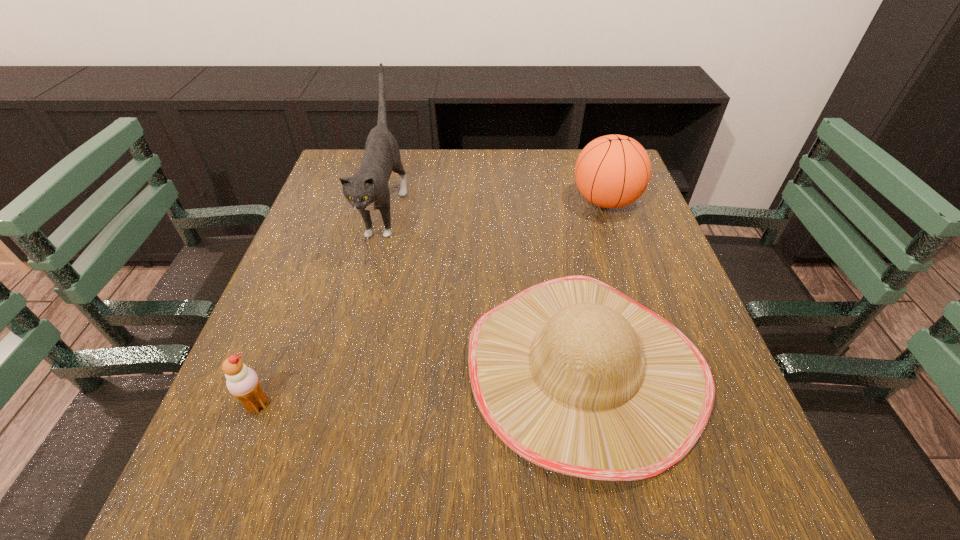
Identify the location of the tallest object. (368, 189).

Where is `cat`? This screenshot has width=960, height=540. cat is located at coordinates (368, 189).

The width and height of the screenshot is (960, 540). I want to click on basketball, so click(x=612, y=171).

Where is `sunhat`? The image size is (960, 540). sunhat is located at coordinates (571, 374).

The image size is (960, 540). Identify the location of the leftmost object. (242, 382).

Where is `vacant space located at the face of the cat`? This screenshot has height=540, width=960. vacant space located at the face of the cat is located at coordinates click(x=354, y=329).

At what (x,y) coordinates should I click in order to perform the action: click on vacant region located 0.060m on the left of the basketball. Please return your answer as a coordinate pair (x, y). This screenshot has width=960, height=540. Looking at the image, I should click on (547, 201).

At what (x,y) coordinates should I click in order to perform the action: click on vacant space located on the left of the sunhat. Please return your answer as a coordinate pair (x, y). Looking at the image, I should click on (288, 367).

Locate an element on the screen. vacant space situated 0.110m at the front with a straw on the leftmost object is located at coordinates (226, 488).

Image resolution: width=960 pixels, height=540 pixels. Find the location of `cat that is positioned at the far edge`. cat that is positioned at the far edge is located at coordinates (368, 189).